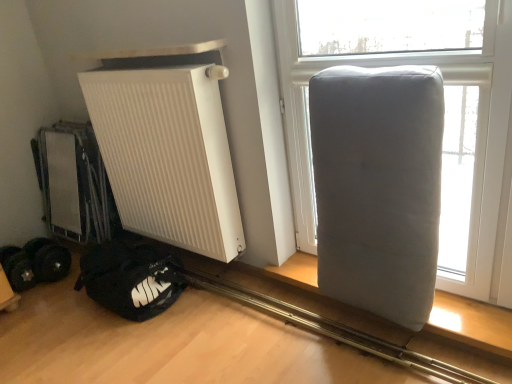
This screenshot has width=512, height=384. What are the coordinates of `vacant space to the left of black fabric sleeping bag at lower left` in the screenshot? It's located at (42, 313).